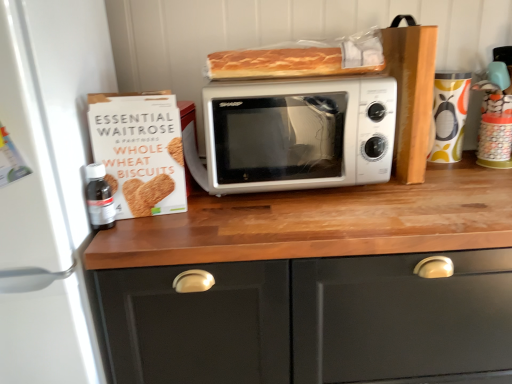
Question: Is matte wood cabinet at center wider than white cardboard box at left?

Choices:
 (A) no
 (B) yes

Answer: (B)

Question: Considering the relative sizes of matte wood cabinet at center and white cardboard box at left in the image provided, is matte wood cabinet at center thinner than white cardboard box at left?

Choices:
 (A) yes
 (B) no

Answer: (B)

Question: Is matte wood cabinet at center closer to camera compared to white cardboard box at left?

Choices:
 (A) yes
 (B) no

Answer: (A)

Question: Does matte wood cabinet at center turn towards white cardboard box at left?

Choices:
 (A) yes
 (B) no

Answer: (B)

Question: Is matte wood cabinet at center to the left of white cardboard box at left from the viewer's perspective?

Choices:
 (A) yes
 (B) no

Answer: (B)

Question: Is matte wood cabinet at center inside the boundaries of transparent plastic bottle at left, or outside?

Choices:
 (A) inside
 (B) outside

Answer: (B)

Question: Is matte wood cabinet at center in front of or behind transparent plastic bottle at left in the image?

Choices:
 (A) front
 (B) behind

Answer: (A)

Question: From their relative heights in the image, would you say matte wood cabinet at center is taller or shorter than transparent plastic bottle at left?

Choices:
 (A) short
 (B) tall

Answer: (B)

Question: From the image's perspective, is matte wood cabinet at center positioned above or below transparent plastic bottle at left?

Choices:
 (A) below
 (B) above

Answer: (A)

Question: In the image, is white matte microwave at center, which is the second appliance from right to left, positioned in front of or behind transparent plastic bottle at left?

Choices:
 (A) behind
 (B) front

Answer: (B)

Question: Does point (52, 175) appear closer or farther from the camera than point (95, 180)?

Choices:
 (A) farther
 (B) closer

Answer: (B)

Question: From the image's perspective, is white matte microwave at center, which is the second appliance from right to left, above or below transparent plastic bottle at left?

Choices:
 (A) above
 (B) below

Answer: (B)

Question: In terms of height, does white matte microwave at center, which is the second appliance from right to left, look taller or shorter compared to transparent plastic bottle at left?

Choices:
 (A) tall
 (B) short

Answer: (A)

Question: Is white matte microwave at center, marked as the 1th appliance in a left-to-right arrangement, situated inside matte ceramic mug at right, the second appliance in the left-to-right sequence, or outside?

Choices:
 (A) inside
 (B) outside

Answer: (B)

Question: In terms of size, does white matte microwave at center, which is the second appliance from right to left, appear bigger or smaller than matte ceramic mug at right, positioned as the 1th appliance in right-to-left order?

Choices:
 (A) small
 (B) big

Answer: (B)